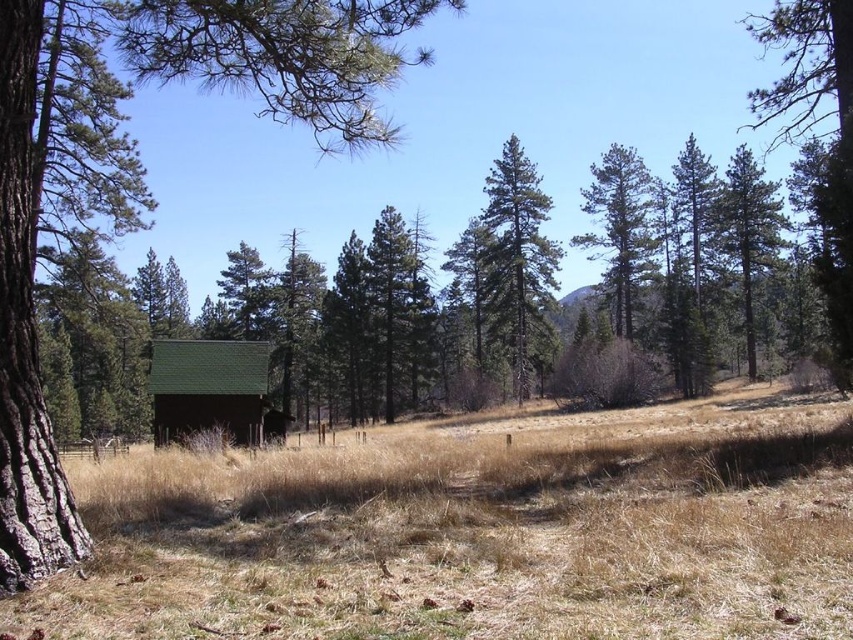
You are standing at the center of the scene. You want to place a small decorative rock exactly at the location of the brown dry grass at center. What are the coordinates where you should place the rock?

The coordinates for the brown dry grass at center are point (x=480, y=532), so you should place the rock there.

You are standing in the middle of the landscape and want to reach the green pine tree at upper right. Which direction should you walk to avoid the green shingled cabin at lower left?

The green shingled cabin at lower left is positioned on the left side of the green pine tree at upper right. To avoid it, you should walk towards the upper right while steering clear of the left side where the cabin is located.

You are a hiker standing in the middle of the scene. You notice the brown dry grass at center and the green textured pine tree at center. Which object is taller?

The green textured pine tree at center is taller than the brown dry grass at center.